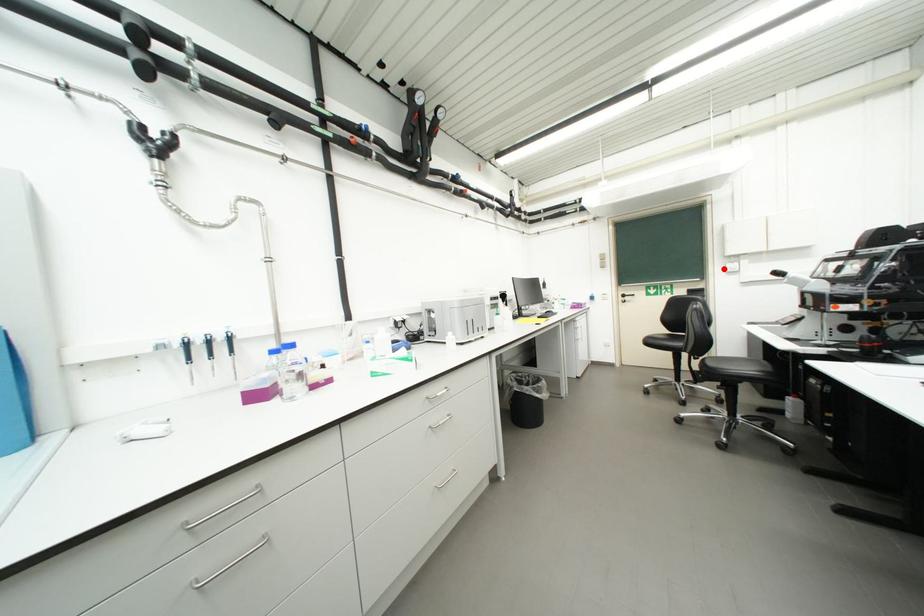
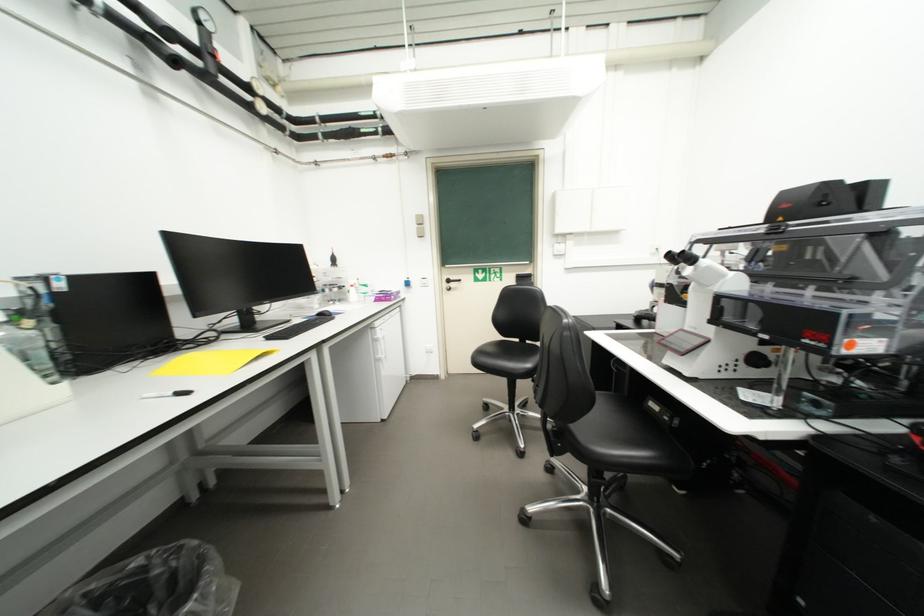
Question: I am providing you with two images of the same scene from different viewpoints. A red point is marked on the first image. At the location where the point appears in image 1, is it still visible in image 2?

Choices:
 (A) Yes
 (B) No

Answer: (A)